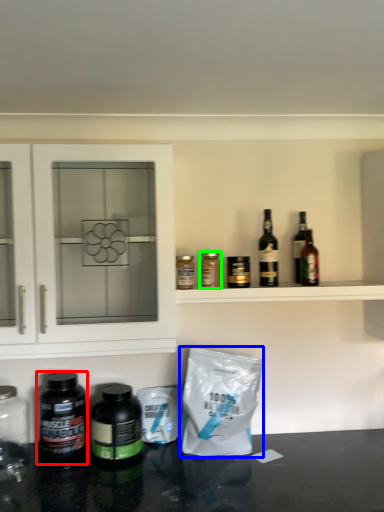
Question: Considering the real-world distances, which object is farthest from bottle (highlighted by a red box)? material (highlighted by a blue box) or bottle (highlighted by a green box)?

Choices:
 (A) material
 (B) bottle

Answer: (B)